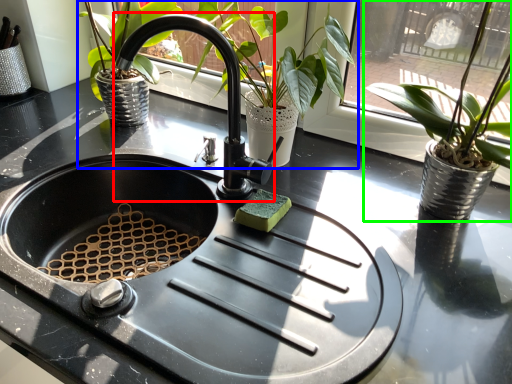
Question: Which is nearer to the faucet (highlighted by a red box)? houseplant (highlighted by a blue box) or houseplant (highlighted by a green box).

Choices:
 (A) houseplant
 (B) houseplant

Answer: (A)